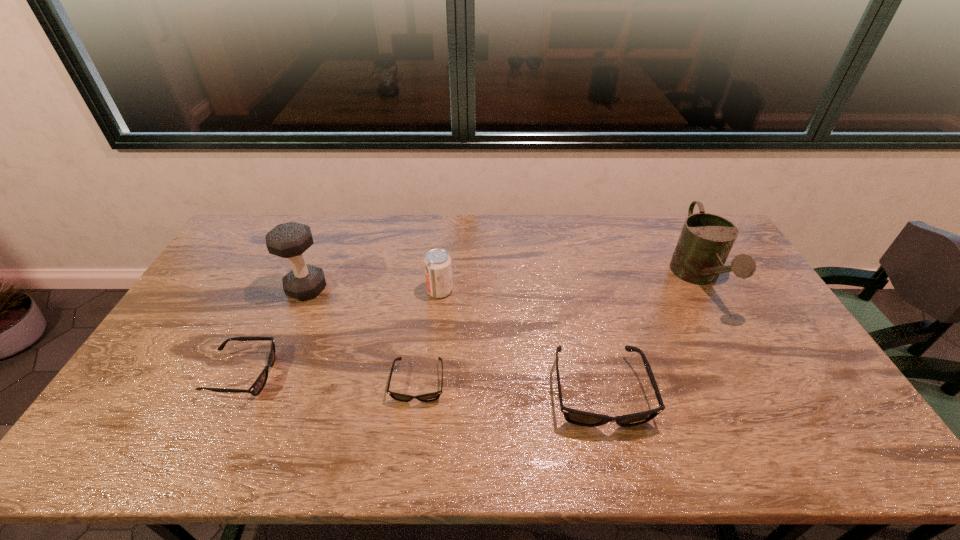
Identify the location of free space located with the spout on the watering can. (775, 417).

The height and width of the screenshot is (540, 960). What are the coordinates of `vacant point located 0.280m on the right of the soda can` in the screenshot? It's located at (540, 291).

Find the location of a particular element. This screenshot has height=540, width=960. vacant space situated 0.260m on the right of the dumbbell is located at coordinates click(x=407, y=288).

Locate an element on the screen. The width and height of the screenshot is (960, 540). object that is at the far edge is located at coordinates (706, 240).

Find the location of `object present at the right edge`. object present at the right edge is located at coordinates (706, 240).

Find the location of a particular element. This screenshot has height=540, width=960. object present at the far right corner is located at coordinates (706, 240).

In the image, there is a desktop. What are the coordinates of `vacant space at the far edge` in the screenshot? It's located at (408, 246).

You are a GUI agent. You are given a task and a screenshot of the screen. Output one action in this format:
    pyautogui.click(x=<x>, y=<y>)
    Task: Click on the vacant space at the near edge of the desktop
    
    Given the screenshot: What is the action you would take?
    pyautogui.click(x=193, y=400)

The width and height of the screenshot is (960, 540). In the image, there is a desktop. Identify the location of vacant space at the left edge. pyautogui.click(x=198, y=341).

In the image, there is a desktop. At what (x,y) coordinates should I click in order to perform the action: click on free region at the right edge. Please return your answer as a coordinate pair (x, y). Image resolution: width=960 pixels, height=540 pixels. Looking at the image, I should click on (749, 307).